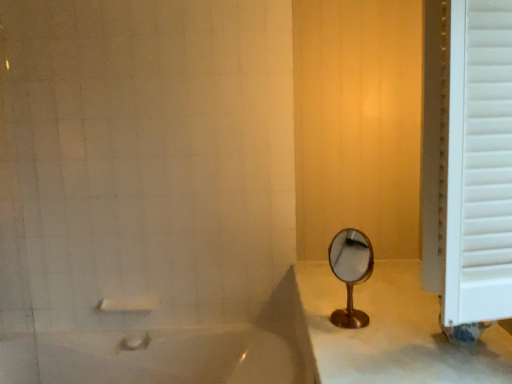
Question: Is white glossy bathtub at lower left aimed at white matte towel bar at lower left?

Choices:
 (A) yes
 (B) no

Answer: (B)

Question: Is white glossy bathtub at lower left wider than white matte towel bar at lower left?

Choices:
 (A) yes
 (B) no

Answer: (A)

Question: Is white glossy bathtub at lower left to the left of white matte towel bar at lower left from the viewer's perspective?

Choices:
 (A) no
 (B) yes

Answer: (A)

Question: From the image's perspective, does white glossy bathtub at lower left appear lower than white matte towel bar at lower left?

Choices:
 (A) no
 (B) yes

Answer: (B)

Question: Considering the relative positions of white glossy bathtub at lower left and white matte towel bar at lower left in the image provided, is white glossy bathtub at lower left to the right of white matte towel bar at lower left from the viewer's perspective?

Choices:
 (A) yes
 (B) no

Answer: (A)

Question: From the image's perspective, is gold metallic mirror at center positioned above or below white glossy bathtub at lower left?

Choices:
 (A) above
 (B) below

Answer: (A)

Question: Looking at their shapes, would you say gold metallic mirror at center is wider or thinner than white glossy bathtub at lower left?

Choices:
 (A) thin
 (B) wide

Answer: (A)

Question: Would you say gold metallic mirror at center is inside or outside white glossy bathtub at lower left?

Choices:
 (A) inside
 (B) outside

Answer: (B)

Question: Looking at the image, does gold metallic mirror at center seem bigger or smaller compared to white glossy bathtub at lower left?

Choices:
 (A) big
 (B) small

Answer: (B)

Question: Is white wooden window frame at right in front of or behind white matte towel bar at lower left in the image?

Choices:
 (A) behind
 (B) front

Answer: (B)

Question: Looking at the image, does white wooden window frame at right seem bigger or smaller compared to white matte towel bar at lower left?

Choices:
 (A) big
 (B) small

Answer: (A)

Question: Looking at their shapes, would you say white wooden window frame at right is wider or thinner than white matte towel bar at lower left?

Choices:
 (A) thin
 (B) wide

Answer: (B)

Question: From the image's perspective, is white wooden window frame at right located above or below white matte towel bar at lower left?

Choices:
 (A) above
 (B) below

Answer: (A)

Question: Is white wooden window frame at right to the left or to the right of white glossy bathtub at lower left in the image?

Choices:
 (A) right
 (B) left

Answer: (A)

Question: Which is correct: white wooden window frame at right is inside white glossy bathtub at lower left, or outside of it?

Choices:
 (A) outside
 (B) inside

Answer: (A)